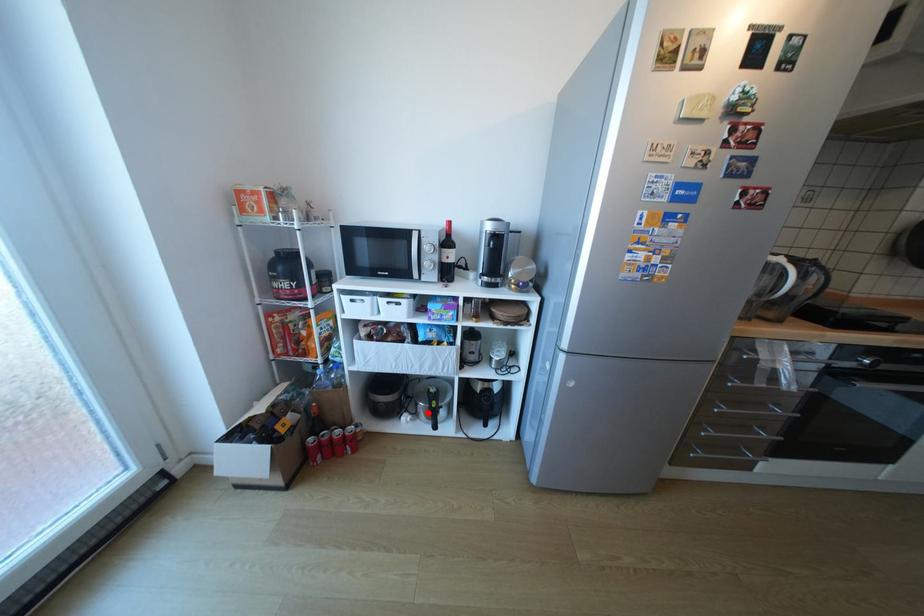
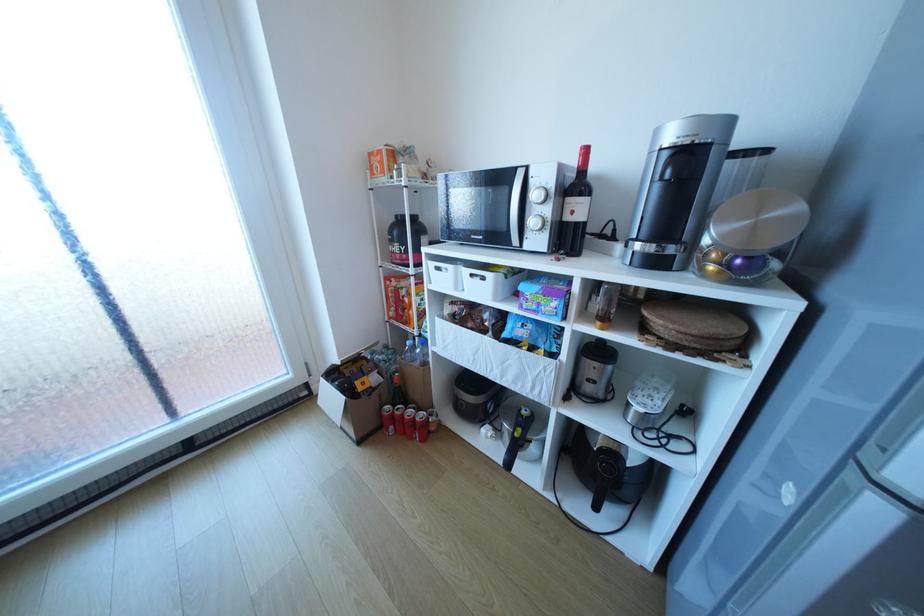
Where in the second image is the point corresponding to the highlighted location from the first image?

(513, 434)